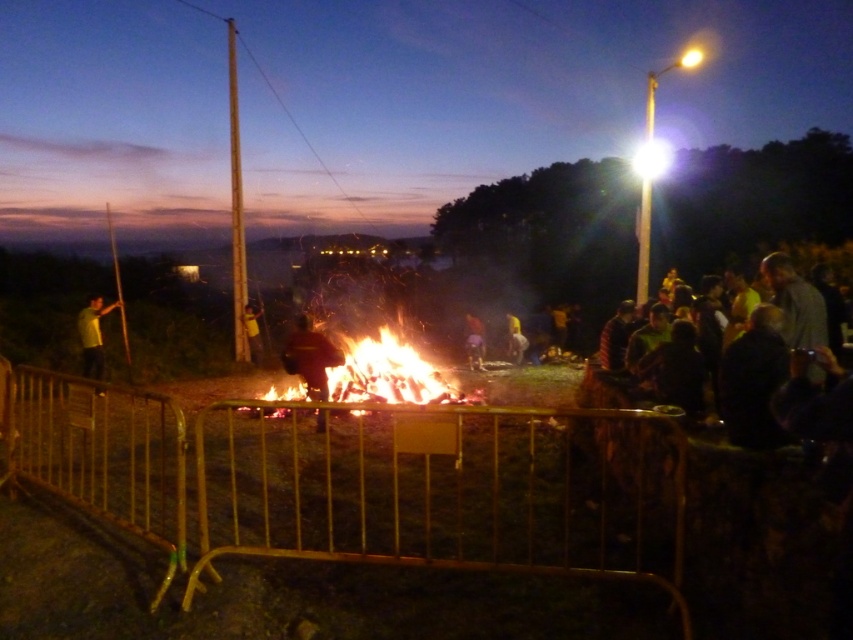
Question: Which point is farther to the camera?

Choices:
 (A) yellow fabric at center
 (B) dark brown leather jacket at center

Answer: (A)

Question: Does yellow matte shirt at left appear on the left side of yellow fabric at center?

Choices:
 (A) yes
 (B) no

Answer: (A)

Question: Which point appears closest to the camera in this image?

Choices:
 (A) (82, 344)
 (B) (259, 340)

Answer: (A)

Question: Is gold metal fence at center above yellow fabric at center?

Choices:
 (A) no
 (B) yes

Answer: (A)

Question: Which point is farther to the camera?

Choices:
 (A) (250, 349)
 (B) (21, 371)
 (C) (473, 362)
 (D) (84, 365)

Answer: (A)

Question: Is flaming wood at center closer to camera compared to yellow fabric at center?

Choices:
 (A) no
 (B) yes

Answer: (B)